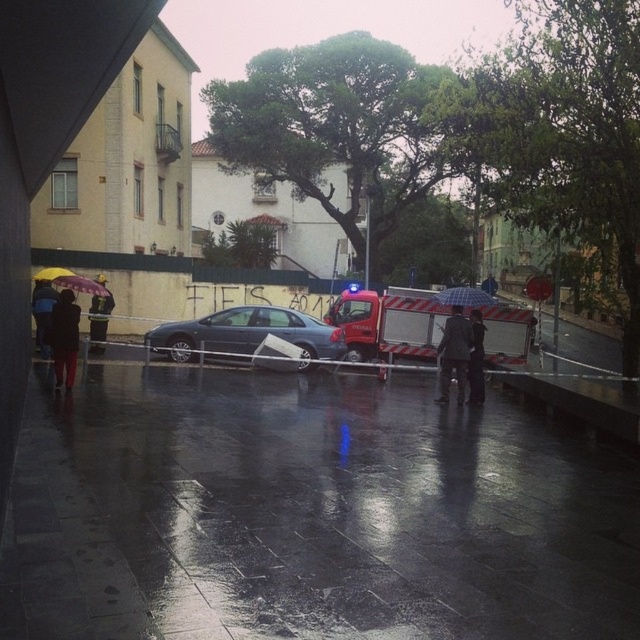
You are standing at the camera position and want to move towards the two points marked in the scene. Which point, point (x=72, y=352) or point (x=454, y=296), will you reach first?

You will reach point (x=72, y=352) first because it is closer to the camera than point (x=454, y=296).

You are a pedestrian caught in the rain while walking past the scene. You see the metallic red fire truck at center and the dark gray fabric umbrella at left. Which object is closer to you?

The metallic red fire truck at center is closer to you because it is in front of the dark gray fabric umbrella at left.

You are a pedestrian trying to cross the street while holding an umbrella. You notice the dark matte jacket at lower left and the plastic checkered umbrella at center. Which item is wider?

The plastic checkered umbrella at center is wider than the dark matte jacket at lower left.